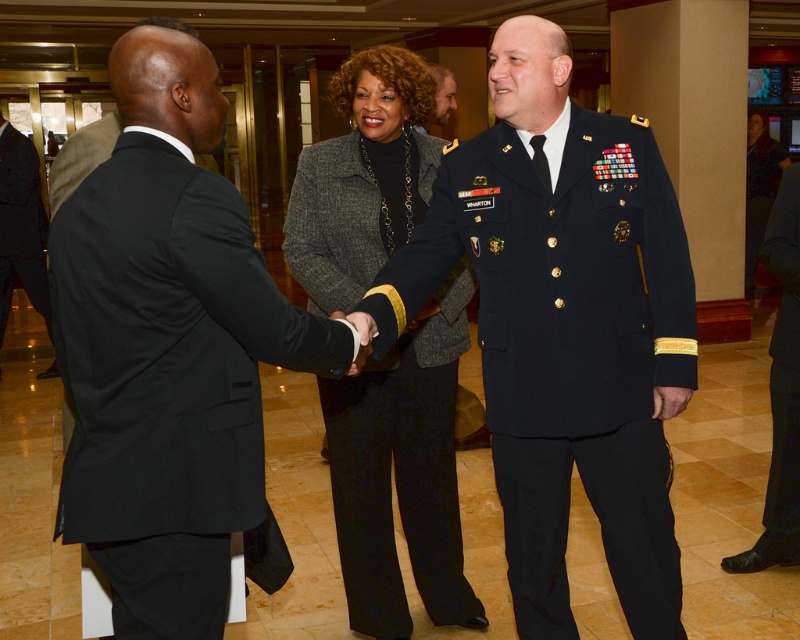
Which is more to the right, gray woolen blazer at center or light brown hair at center?

Positioned to the right is light brown hair at center.

Looking at this image, does gray woolen blazer at center have a lesser width compared to light brown hair at center?

In fact, gray woolen blazer at center might be wider than light brown hair at center.

The image size is (800, 640). Find the location of `gray woolen blazer at center`. gray woolen blazer at center is located at coordinates pyautogui.click(x=402, y=474).

Identify the location of gray woolen blazer at center. The image size is (800, 640). (402, 474).

Which is above, black suit at left or light brown hair at center?

Positioned higher is light brown hair at center.

Looking at this image, who is more distant from viewer, (x=216, y=80) or (x=440, y=90)?

The point (x=440, y=90) is behind.

Which is behind, point (162, 268) or point (434, 122)?

Positioned behind is point (434, 122).

Identify the location of black suit at left. (168, 348).

Looking at this image, does navy blue uniform at center have a greater width compared to light brown hair at center?

Yes.

Between navy blue uniform at center and light brown hair at center, which one is positioned higher?

light brown hair at center

Who is more distant from viewer, (690, 353) or (440, 124)?

The point (440, 124) is behind.

This screenshot has width=800, height=640. I want to click on navy blue uniform at center, so click(x=566, y=328).